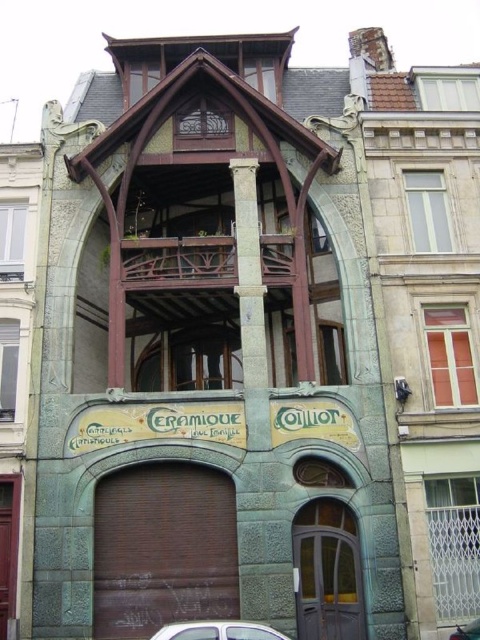
You are standing in front of the building described in the scene. There is a brown matte door at center. Where is the brown matte door located relative to the point at coordinates (163, 548)?

The brown matte door at center is located exactly at the point with coordinates (163, 548).

You are a delivery person trying to enter the building through the brown matte door at center. There is a silver metallic car at lower center blocking the entrance. Can you still enter the door?

The brown matte door at center is bigger than the silver metallic car at lower center, so the car is smaller and might not fully block the entrance. You can likely enter the door by moving around the car or through the remaining space.

You are a visitor arriving at the building and see the brown matte door at center and the silver metallic car at lower center. Which object is closer to you as you approach the building?

The silver metallic car at lower center is closer to you because it is positioned in front of the brown matte door at center, which is behind it.